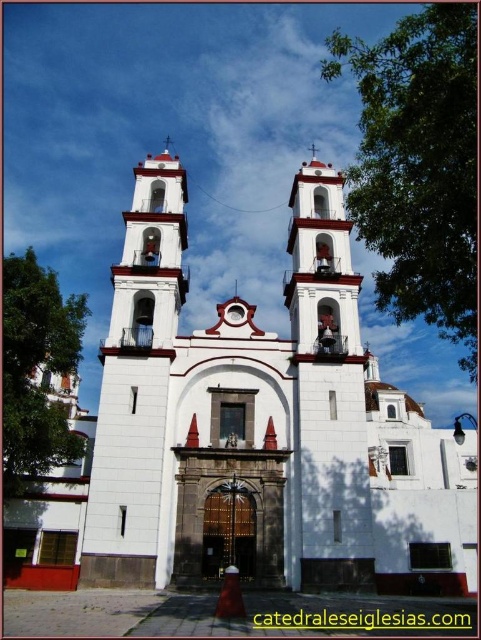
Question: Which point appears closest to the camera in this image?

Choices:
 (A) (399, 429)
 (B) (303, 333)

Answer: (B)

Question: Which object appears farthest from the camera in this image?

Choices:
 (A) white stucco bell tower at center
 (B) white stucco church at center

Answer: (A)

Question: Is white stucco church at center above white stucco bell tower at center?

Choices:
 (A) no
 (B) yes

Answer: (A)

Question: Is white stucco church at center above white stucco bell tower at center?

Choices:
 (A) no
 (B) yes

Answer: (A)

Question: Is white stucco church at center positioned behind white stucco bell tower at center?

Choices:
 (A) yes
 (B) no

Answer: (B)

Question: Which object appears farthest from the camera in this image?

Choices:
 (A) white stucco bell tower at center
 (B) white stucco church at center

Answer: (A)